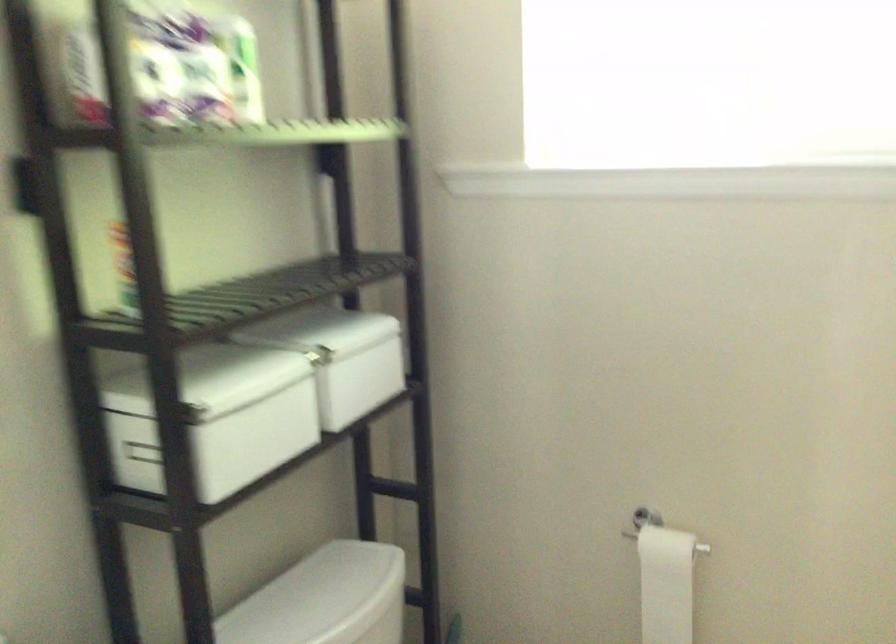
Where would you pull the toilet paper roll? Please return your answer as a coordinate pair (x, y).

(666, 583)